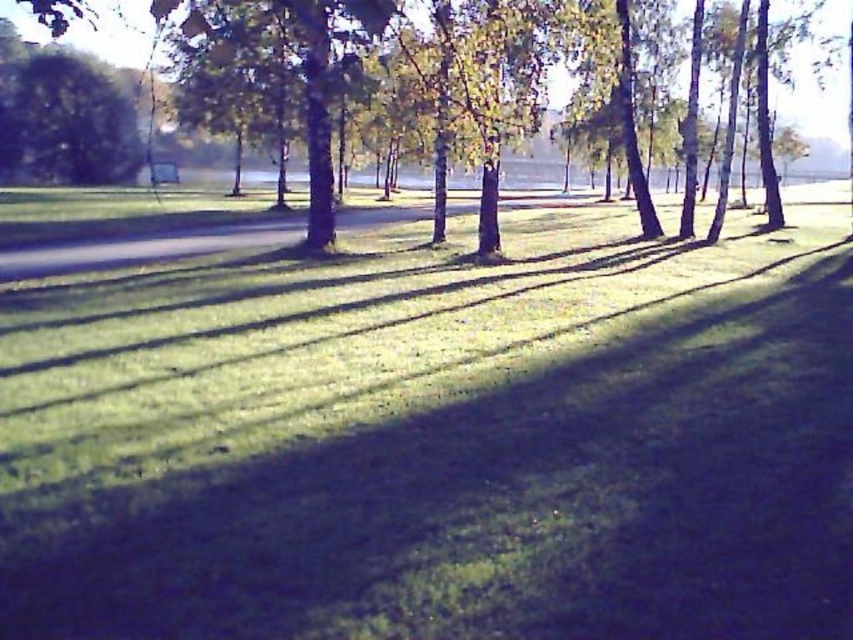
You are planning to set up a picnic blanket in the green grassy area at center. However, you want to ensure that the area is not shaded by the green leafy tree at center. Based on the scene description, will the green grassy at center be in direct sunlight or shaded by the tree?

The green grassy at center is positioned under green leafy tree at center, so it will be shaded by the tree and not in direct sunlight.

You are a gardener planning to mow the green grassy at center and trim the green leafy tree at upper left. Based on their heights, which task would require a ladder?

The green leafy tree at upper left is taller than the green grassy at center, so trimming it would require a ladder.

You are a bird looking for a nesting spot. You see the green leafy tree at upper left and the green leafy tree at center. Which tree would you choose if you prefer a smaller tree for nesting?

The green leafy tree at upper left has a smaller size compared to the green leafy tree at center, so the bird would choose the green leafy tree at upper left for nesting.